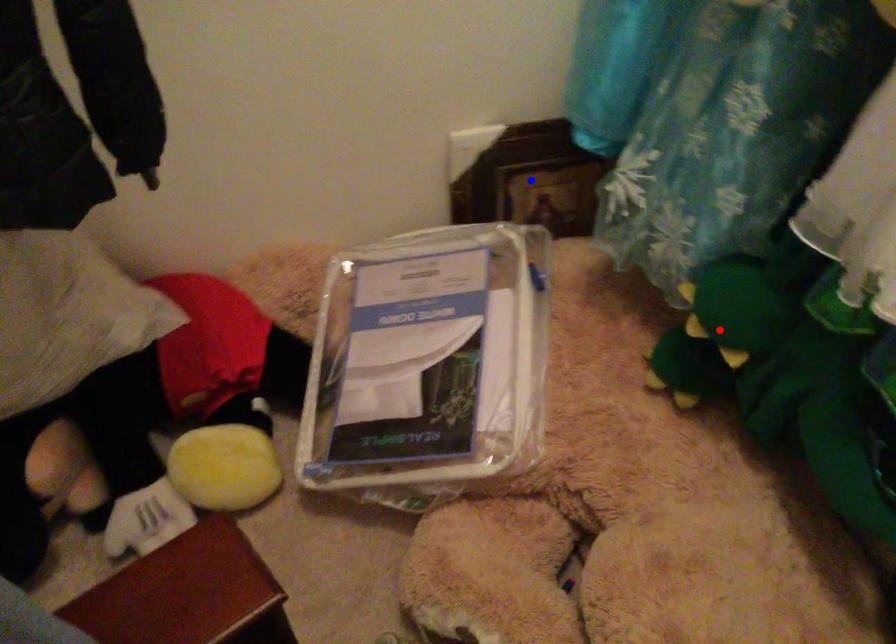
Question: Two points are marked on the image. Which point is closer to the camera?

Choices:
 (A) Blue point is closer.
 (B) Red point is closer.

Answer: (B)